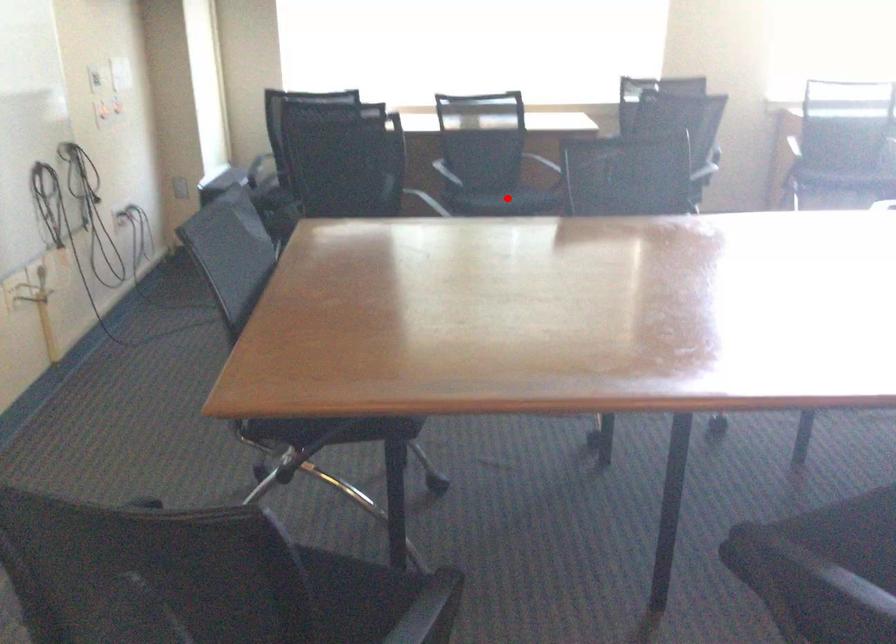
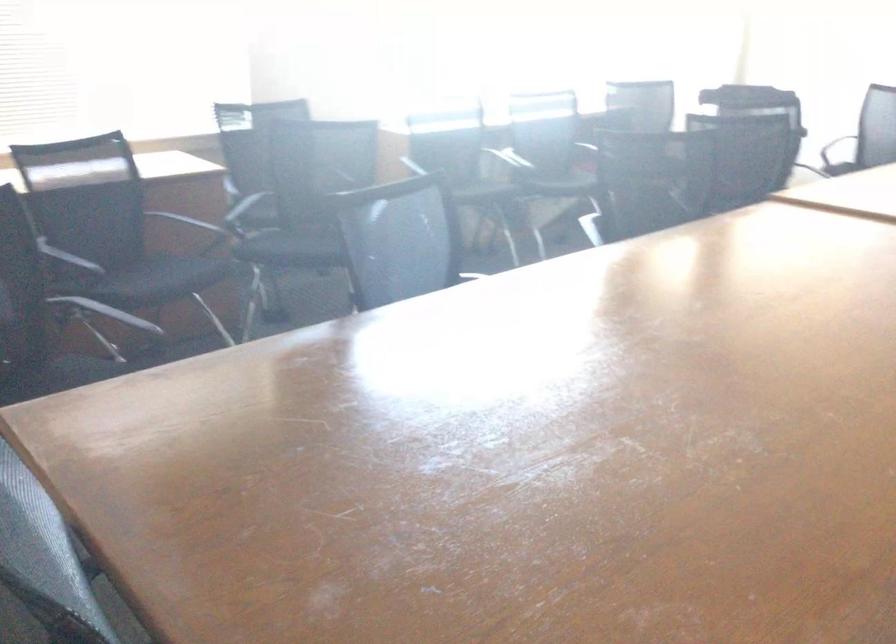
Find the pixel in the second image that matches the highlighted location in the first image.

(159, 279)